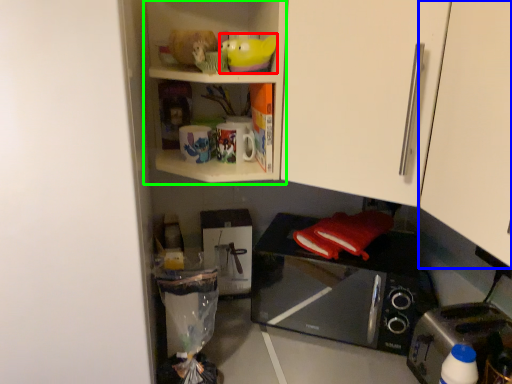
Question: Estimate the real-world distances between objects in this image. Which object is closer to toy (highlighted by a red box), cabinetry (highlighted by a blue box) or cabinet (highlighted by a green box)?

Choices:
 (A) cabinetry
 (B) cabinet

Answer: (B)